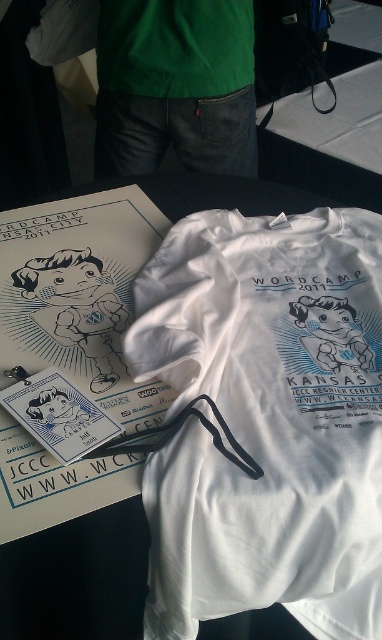
Question: Which point is closer to the camera?

Choices:
 (A) matte paper sticker at upper left
 (B) green matte shirt at center

Answer: (A)

Question: Which object is positioned closest to the green matte shirt at center?

Choices:
 (A) matte plastic badge at center
 (B) matte black t-shirt at center
 (C) white cotton t-shirt at center

Answer: (B)

Question: Is matte plastic badge at center wider than matte paper sticker at upper left?

Choices:
 (A) yes
 (B) no

Answer: (A)

Question: Which point is farther to the camera?

Choices:
 (A) (22, 406)
 (B) (14, 276)
 (C) (189, 33)
 (D) (42, 406)

Answer: (C)

Question: Is green matte shirt at center further to camera compared to matte black t-shirt at center?

Choices:
 (A) no
 (B) yes

Answer: (B)

Question: Where is white cotton t-shirt at center located in relation to green matte shirt at center in the image?

Choices:
 (A) left
 (B) right

Answer: (B)